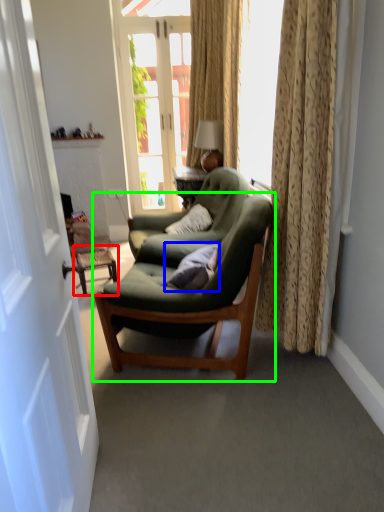
Question: Based on their relative distances, which object is farther from side table (highlighted by a red box)? Choose from pillow (highlighted by a blue box) and chair (highlighted by a green box).

Choices:
 (A) pillow
 (B) chair

Answer: (A)